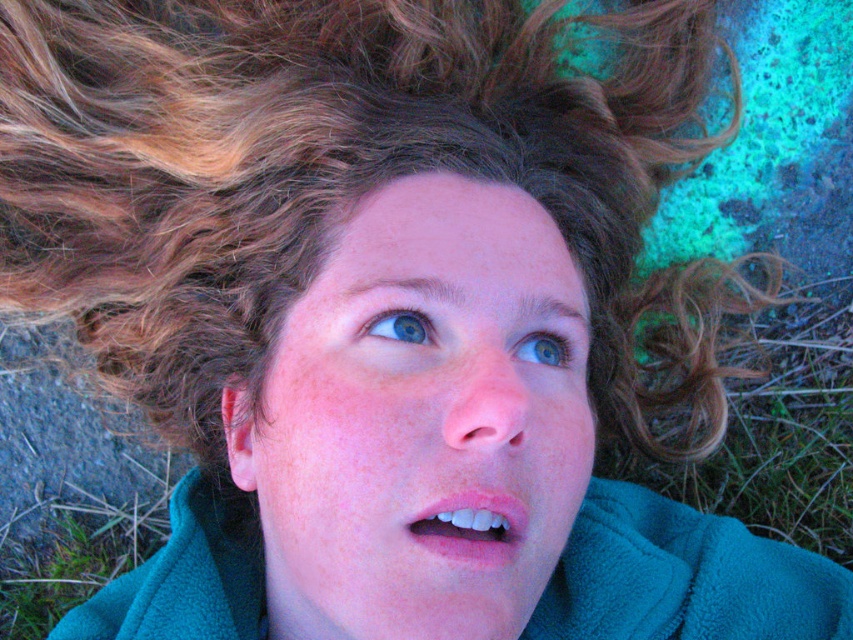
Question: Which point appears farthest from the camera in this image?

Choices:
 (A) (474, 362)
 (B) (525, 340)
 (C) (590, 524)
 (D) (445, 499)

Answer: (C)

Question: Which point is closer to the camera taking this photo?

Choices:
 (A) (396, 324)
 (B) (781, 570)

Answer: (A)

Question: Does blue matte eye at upper center lie behind blue glossy eye at upper center?

Choices:
 (A) no
 (B) yes

Answer: (A)

Question: Does teal fleece robe at center have a larger size compared to blue glossy eye at upper center?

Choices:
 (A) no
 (B) yes

Answer: (B)

Question: Is teal fleece robe at center positioned before blue glossy eye at upper center?

Choices:
 (A) no
 (B) yes

Answer: (A)

Question: Which of these objects is positioned closest to the blue glossy eye at upper center?

Choices:
 (A) pink matte lips at center
 (B) blue matte eye at upper center

Answer: (B)